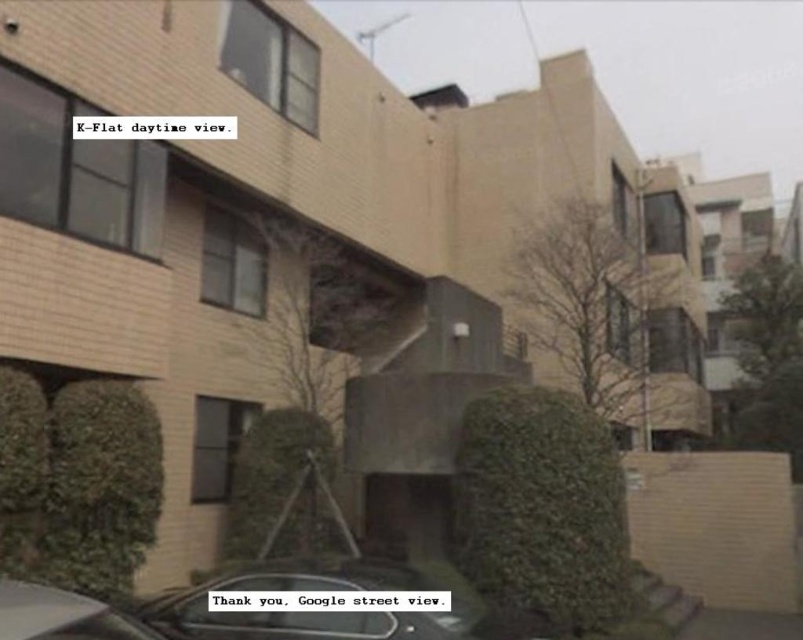
You are a delivery person trying to park your delivery van between the metallic gray car at lower center and the shiny silver car at lower left. The van is 6 meters long. Can you fit it in the space between them?

The metallic gray car at lower center is larger than the shiny silver car at lower left, but the exact distance between them isn not provided. Without knowing the actual space available, it is impossible to determine if the van will fit.